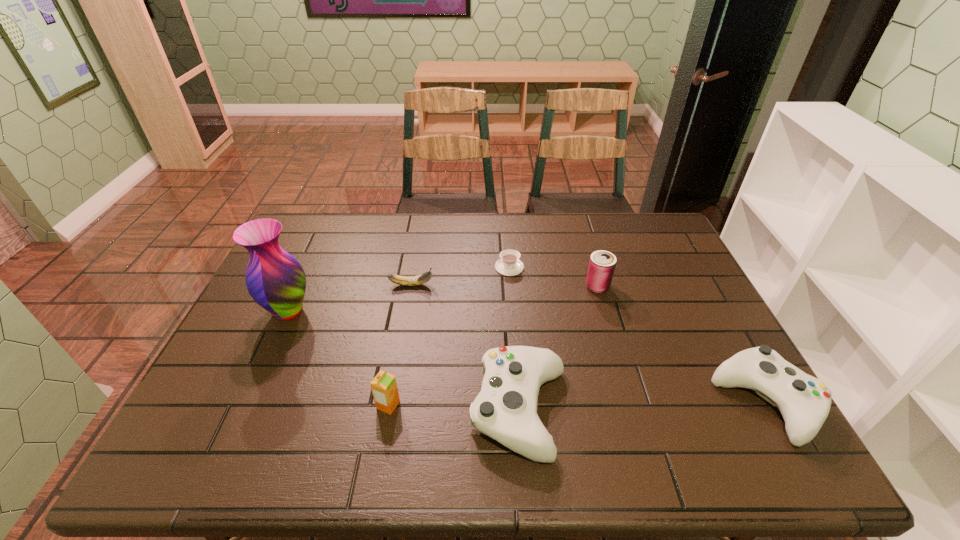
Where is `free space in the image that satisfies the following two spatial constraints: 1. at the stem of the right control; 2. on the right side of the banana`? This screenshot has height=540, width=960. free space in the image that satisfies the following two spatial constraints: 1. at the stem of the right control; 2. on the right side of the banana is located at coordinates (391, 402).

The image size is (960, 540). What are the coordinates of `vacant space that satisfies the following two spatial constraints: 1. on the back side of the can; 2. on the left side of the taller control` in the screenshot? It's located at coord(510,286).

This screenshot has width=960, height=540. In order to click on free point that satisfies the following two spatial constraints: 1. at the stem of the banana; 2. on the left side of the shorter control in this screenshot , I will do `click(391, 402)`.

The height and width of the screenshot is (540, 960). What are the coordinates of `vacant position in the image that satisfies the following two spatial constraints: 1. on the handle side of the farthest object; 2. on the left side of the sixth object from left to right` in the screenshot? It's located at (511, 286).

Locate an element on the screen. The height and width of the screenshot is (540, 960). vacant region that satisfies the following two spatial constraints: 1. at the stem of the banana; 2. on the left side of the second object from right to left is located at coordinates (411, 286).

The width and height of the screenshot is (960, 540). I want to click on free spot that satisfies the following two spatial constraints: 1. at the stem of the can; 2. on the left side of the banana, so click(x=411, y=286).

At what (x,y) coordinates should I click in order to perform the action: click on free space that satisfies the following two spatial constraints: 1. on the handle side of the farthest object; 2. on the front side of the vase. Please return your answer as a coordinate pair (x, y). Looking at the image, I should click on (513, 311).